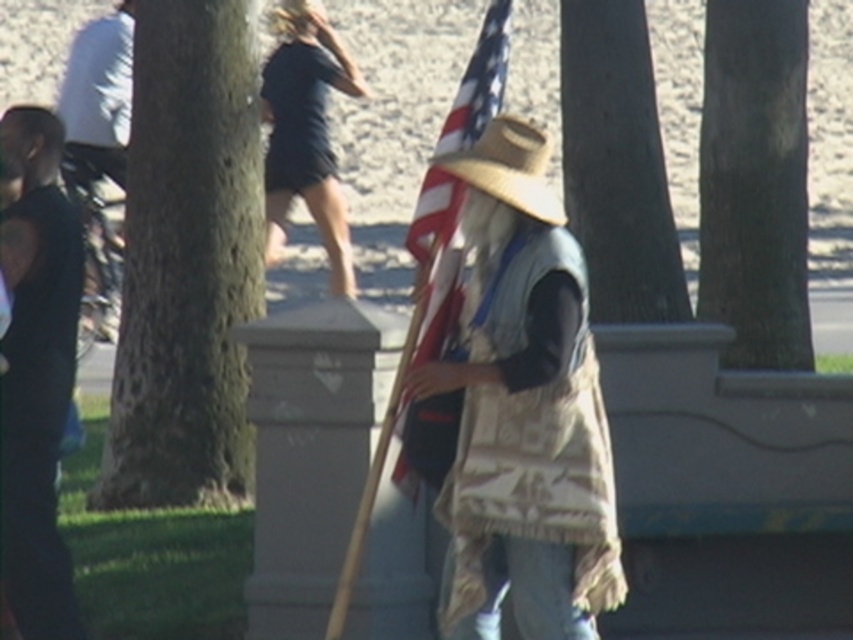
Can you confirm if black sleeveless shirt at left is shorter than tan woven cowboy hat at center?

In fact, black sleeveless shirt at left may be taller than tan woven cowboy hat at center.

Does point (30, 424) come behind point (495, 140)?

Yes, it is behind point (495, 140).

I want to click on black sleeveless shirt at left, so click(x=38, y=371).

Does camouflage fabric flag at center come behind camouflage fabric hat at upper center?

No, camouflage fabric flag at center is in front of camouflage fabric hat at upper center.

Can you confirm if camouflage fabric flag at center is shorter than camouflage fabric hat at upper center?

Yes, camouflage fabric flag at center is shorter than camouflage fabric hat at upper center.

The width and height of the screenshot is (853, 640). Describe the element at coordinates (523, 410) in the screenshot. I see `camouflage fabric flag at center` at that location.

Where is `camouflage fabric flag at center`? The height and width of the screenshot is (640, 853). camouflage fabric flag at center is located at coordinates point(523,410).

Between american flag at center and camouflage fabric hat at upper center, which one has more height?

With more height is camouflage fabric hat at upper center.

Does american flag at center have a lesser width compared to camouflage fabric hat at upper center?

Correct, american flag at center's width is less than camouflage fabric hat at upper center's.

Which is in front, point (408, 444) or point (120, 136)?

Point (408, 444) is more forward.

Identify the location of american flag at center. (437, 260).